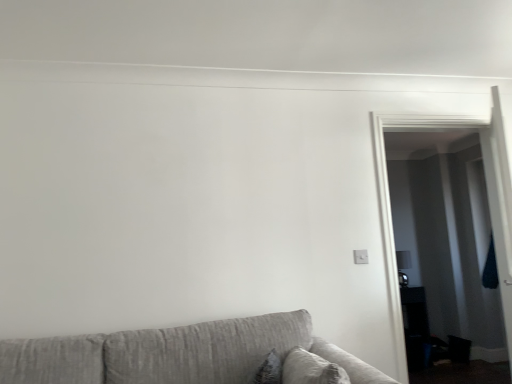
Question: Is transparent glass door at right turned away from textured gray couch at lower left?

Choices:
 (A) no
 (B) yes

Answer: (A)

Question: Is transparent glass door at right oriented towards textured gray couch at lower left?

Choices:
 (A) no
 (B) yes

Answer: (A)

Question: Considering the relative positions of transparent glass door at right and textured gray couch at lower left in the image provided, is transparent glass door at right in front of textured gray couch at lower left?

Choices:
 (A) yes
 (B) no

Answer: (B)

Question: Is transparent glass door at right placed right next to textured gray couch at lower left?

Choices:
 (A) yes
 (B) no

Answer: (B)

Question: Is transparent glass door at right far from textured gray couch at lower left?

Choices:
 (A) yes
 (B) no

Answer: (A)

Question: Can you confirm if transparent glass door at right is wider than textured gray couch at lower left?

Choices:
 (A) no
 (B) yes

Answer: (A)

Question: Could you tell me if textured gray couch at lower left is facing transparent glass door at right?

Choices:
 (A) no
 (B) yes

Answer: (A)

Question: Considering the relative positions of textured gray couch at lower left and transparent glass door at right in the image provided, is textured gray couch at lower left to the left of transparent glass door at right from the viewer's perspective?

Choices:
 (A) no
 (B) yes

Answer: (B)

Question: From the image's perspective, is textured gray couch at lower left under transparent glass door at right?

Choices:
 (A) no
 (B) yes

Answer: (B)

Question: Is textured gray couch at lower left far away from transparent glass door at right?

Choices:
 (A) yes
 (B) no

Answer: (A)

Question: From the image's perspective, is textured gray couch at lower left on top of transparent glass door at right?

Choices:
 (A) yes
 (B) no

Answer: (B)

Question: Is the depth of textured gray couch at lower left greater than that of transparent glass door at right?

Choices:
 (A) no
 (B) yes

Answer: (A)

Question: From a real-world perspective, is transparent glass door at right above or below textured gray couch at lower left?

Choices:
 (A) above
 (B) below

Answer: (A)